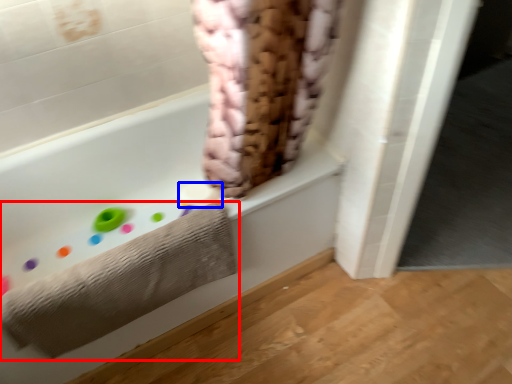
Question: Which object appears closest to the camera in this image, towel (highlighted by a red box) or toilet paper (highlighted by a blue box)?

Choices:
 (A) towel
 (B) toilet paper

Answer: (A)